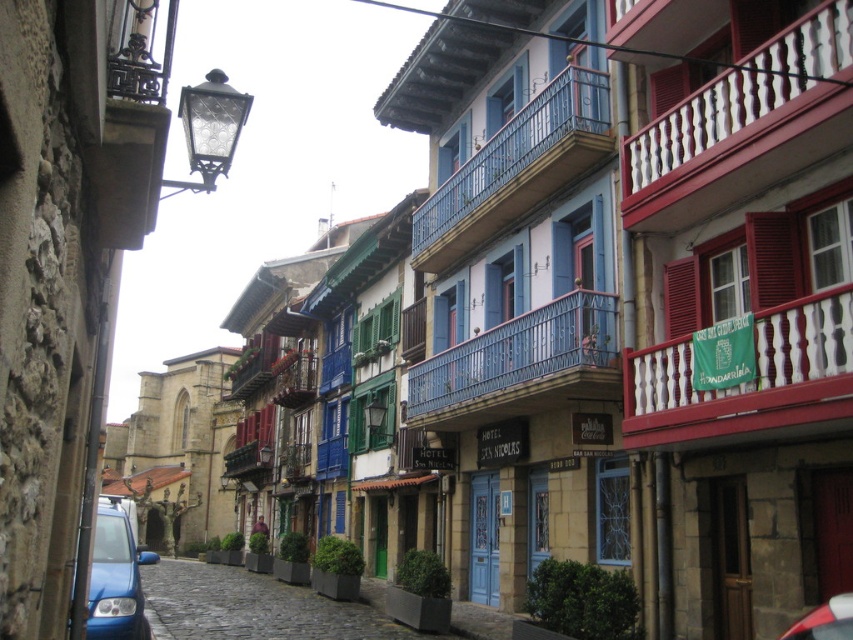
Question: Does blue wrought iron balcony at center appear on the left side of blue matte car at lower left?

Choices:
 (A) no
 (B) yes

Answer: (A)

Question: Estimate the real-world distances between objects in this image. Which object is farther from the white wooden railing at upper right?

Choices:
 (A) blue painted metal railing at upper center
 (B) metallic red car at lower right
 (C) white wooden balcony at right
 (D) blue wrought iron balcony at center

Answer: (B)

Question: Does blue painted metal railing at upper center have a greater width compared to blue matte car at lower left?

Choices:
 (A) yes
 (B) no

Answer: (B)

Question: Among these points, which one is farthest from the camera?

Choices:
 (A) (811, 616)
 (B) (537, 99)

Answer: (B)

Question: Does blue matte car at lower left have a lesser width compared to metallic red car at lower right?

Choices:
 (A) yes
 (B) no

Answer: (B)

Question: Which of these objects is positioned farthest from the blue painted metal railing at upper center?

Choices:
 (A) blue matte car at lower left
 (B) blue wrought iron balcony at center
 (C) white wooden balcony at right

Answer: (A)